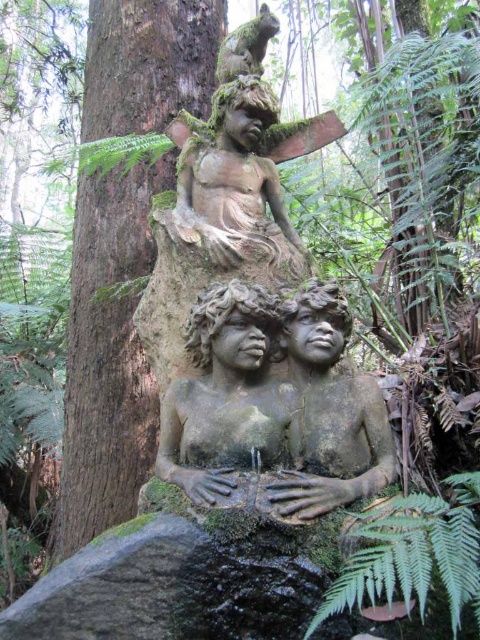
Measure the distance between stone textured statue at center and stone statue at upper center.

stone textured statue at center and stone statue at upper center are 20.38 inches apart from each other.

Measure the distance between point (x=223, y=378) and camera.

The distance of point (x=223, y=378) from camera is 6.76 feet.

At what (x,y) coordinates should I click in order to perform the action: click on stone textured statue at center. Please return your answer as a coordinate pair (x, y). The width and height of the screenshot is (480, 640). Looking at the image, I should click on [228, 396].

This screenshot has width=480, height=640. In order to click on stone textured statue at center in this screenshot , I will do (228, 396).

Is stone textured statue at center below green leafy fern at lower center?

No.

The image size is (480, 640). I want to click on stone textured statue at center, so click(228, 396).

The image size is (480, 640). Identify the location of stone textured statue at center. (228, 396).

Who is shorter, brown rough tree trunk at center or stone statue at upper center?

Standing shorter between the two is stone statue at upper center.

Which is behind, point (115, 225) or point (249, 108)?

The point (115, 225) is behind.

Locate an element on the screen. brown rough tree trunk at center is located at coordinates tap(107, 356).